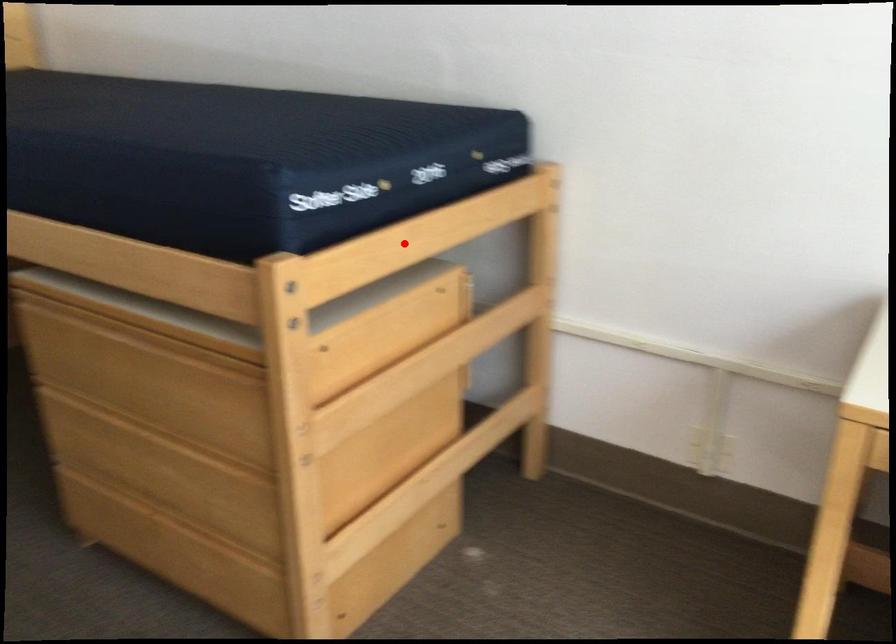
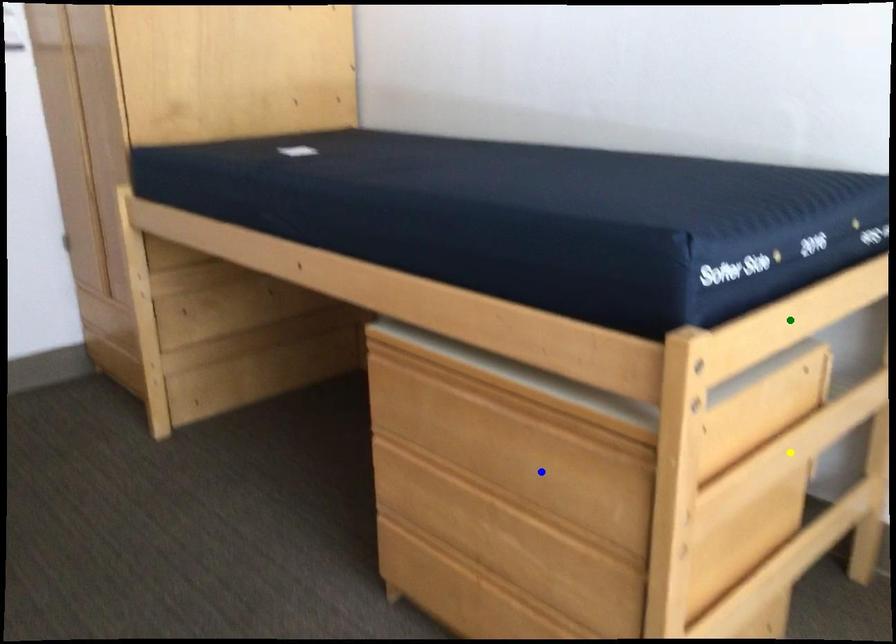
Question: I am providing you with two images of the same scene from different viewpoints. A red point is marked on the first image. You are given multiple points on the second image. Which point in image 2 represents the same 3d spot as the red point in image 1?

Choices:
 (A) green point
 (B) yellow point
 (C) blue point

Answer: (A)